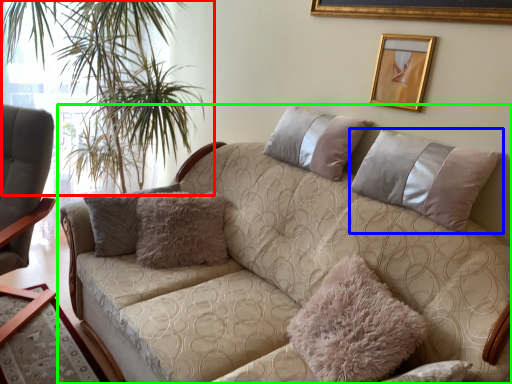
Question: Based on their relative distances, which object is nearer to plant (highlighted by a red box)? Choose from pillow (highlighted by a blue box) and studio couch (highlighted by a green box).

Choices:
 (A) pillow
 (B) studio couch

Answer: (B)